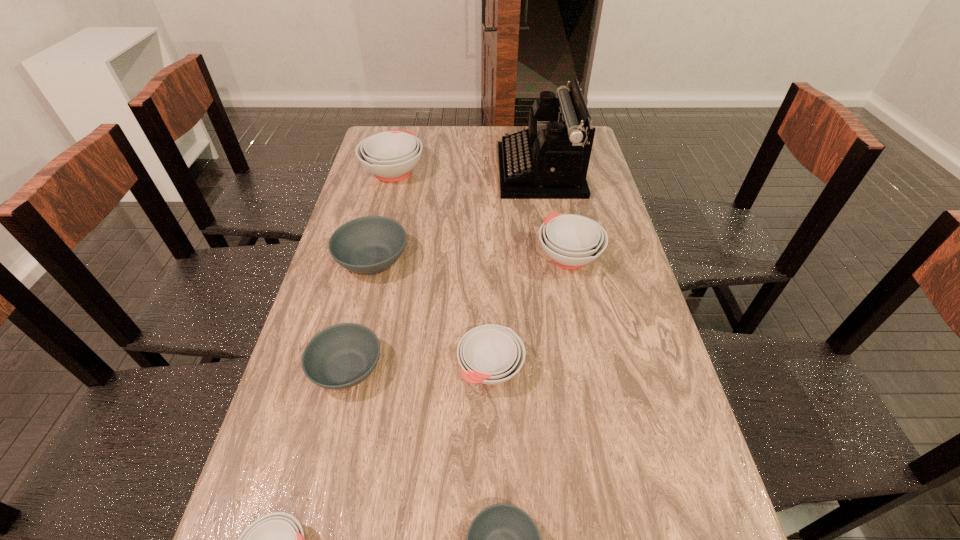
Identify the location of typewriter that is at the right edge. click(549, 160).

Identify the location of soup bowl present at the right edge. This screenshot has height=540, width=960. (571, 241).

The height and width of the screenshot is (540, 960). I want to click on object at the far left corner, so click(391, 155).

Locate an element on the screen. object present at the far right corner is located at coordinates (549, 160).

This screenshot has width=960, height=540. In order to click on free space at the far edge of the desktop in this screenshot , I will do `click(439, 134)`.

This screenshot has width=960, height=540. Find the location of `vacant area at the left edge`. vacant area at the left edge is located at coordinates point(346,301).

In the image, there is a desktop. Identify the location of free space at the right edge. The height and width of the screenshot is (540, 960). 651,337.

The image size is (960, 540). I want to click on empty space between the second smallest gray soup bowl and the third farthest white soup bowl, so click(x=419, y=368).

Where is `vacant space that's between the second farthest white soup bowl and the second smallest white soup bowl`? vacant space that's between the second farthest white soup bowl and the second smallest white soup bowl is located at coordinates (530, 312).

At what (x,y) coordinates should I click in order to perform the action: click on empty location between the rightmost white soup bowl and the second white soup bowl from right to left. Please return your answer as a coordinate pair (x, y). Image resolution: width=960 pixels, height=540 pixels. Looking at the image, I should click on (530, 312).